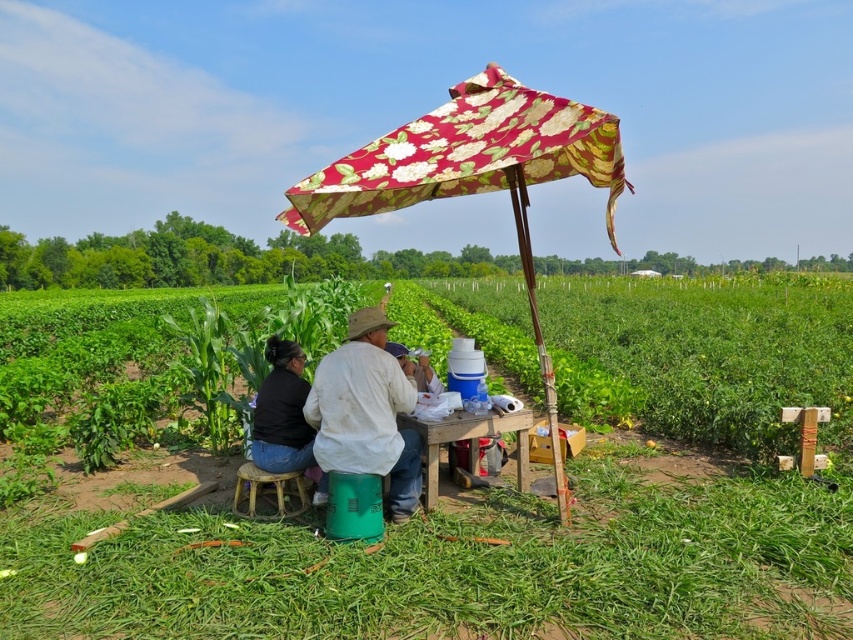
You are a farmer who wants to protect your crops from the intense sunlight. You have a floral fabric umbrella at center and a black fabric shirt at lower left. Which item can provide more shade coverage for your crops?

The floral fabric umbrella at center has a larger size compared to the black fabric shirt at lower left, so it can provide more shade coverage for your crops.

You are standing at the edge of the field looking towards the table. Which object is closer to you between the floral fabric umbrella at center and the black fabric shirt at lower left?

The floral fabric umbrella at center is closer to you because it is in front of the black fabric shirt at lower left.

You are a farmer who wants to place a 30 inch wide basket on the wooden table at center. Can the basket fit on the table if the table is 36.03 inches away from the brown woven stool at lower center?

The wooden table at center is 36.03 inches away from the brown woven stool at lower center, but the distance between them does not indicate the table size. The question about the basket fitting requires knowing the table dimensions, which are not provided in the description.